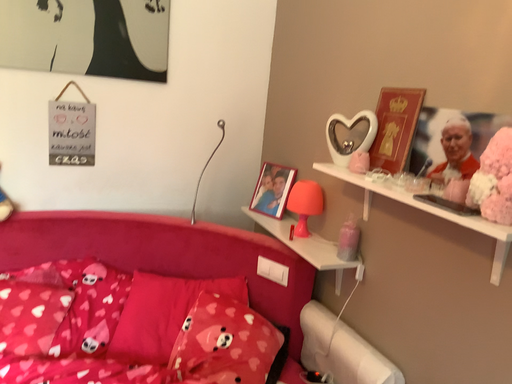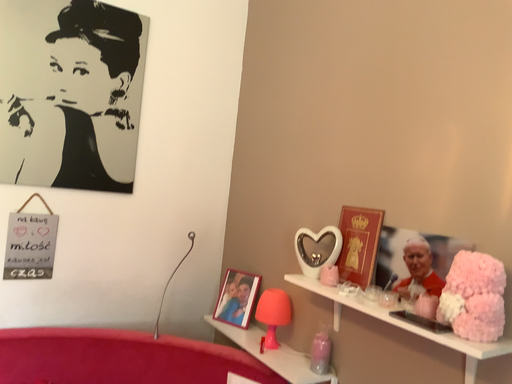
Question: How did the camera likely rotate when shooting the video?

Choices:
 (A) rotated right
 (B) rotated left

Answer: (A)